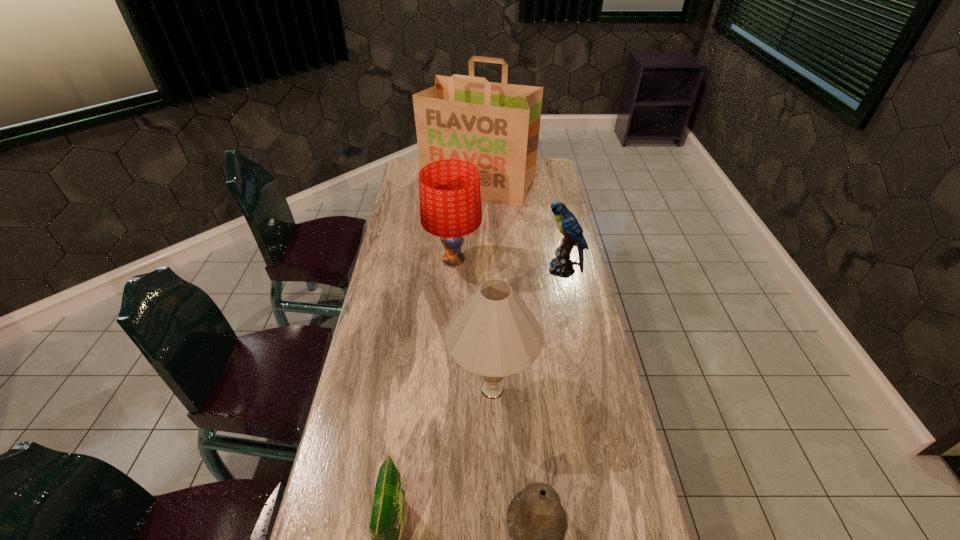
Identify the location of free space that is in between the farther lampshade and the third shortest object. (508, 265).

Locate an element on the screen. object that is the third closest to the parrot is located at coordinates (495, 126).

Locate an element on the screen. The image size is (960, 540). the second closest object relative to the tallest object is located at coordinates click(x=562, y=266).

Identify the location of vacant point that satisfies the following two spatial constraints: 1. on the front-facing side of the farther lampshade; 2. on the left side of the fourth farthest object. (445, 389).